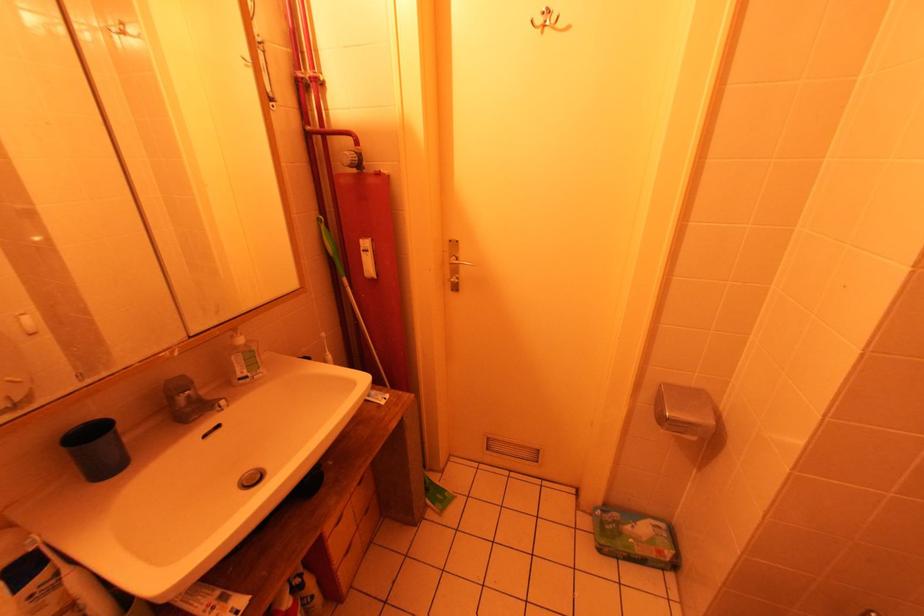
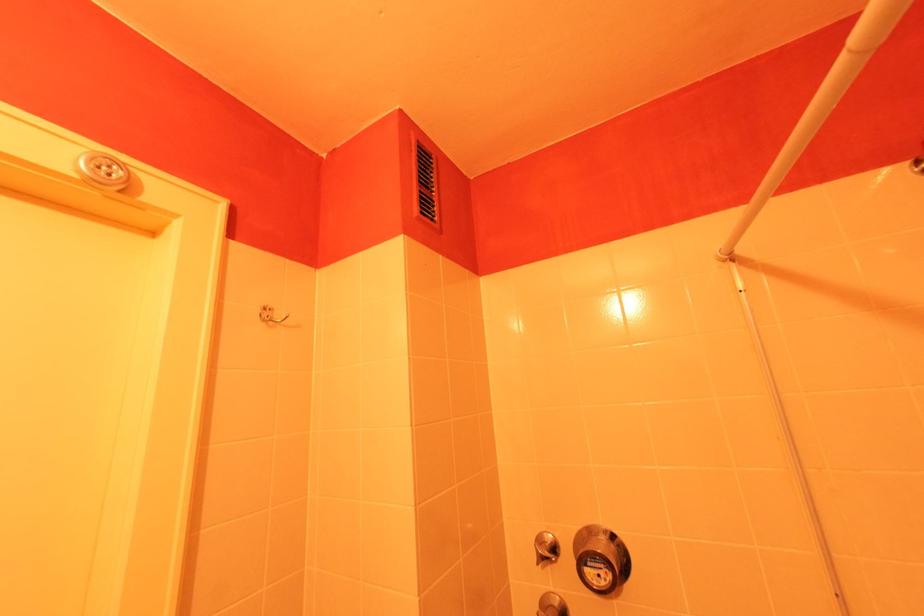
The first image is from the beginning of the video and the second image is from the end. How did the camera likely rotate when shooting the video?

The camera's rotation is toward right-up.